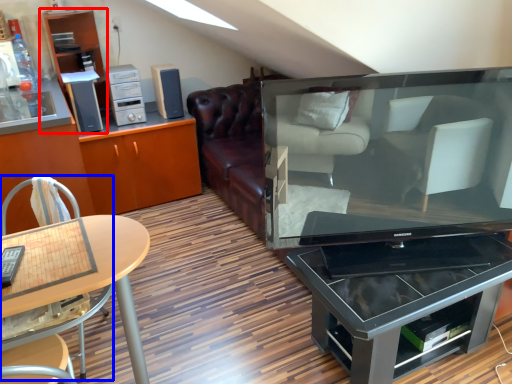
Question: Which object is further to the camera taking this photo, shelf (highlighted by a red box) or chair (highlighted by a blue box)?

Choices:
 (A) shelf
 (B) chair

Answer: (A)